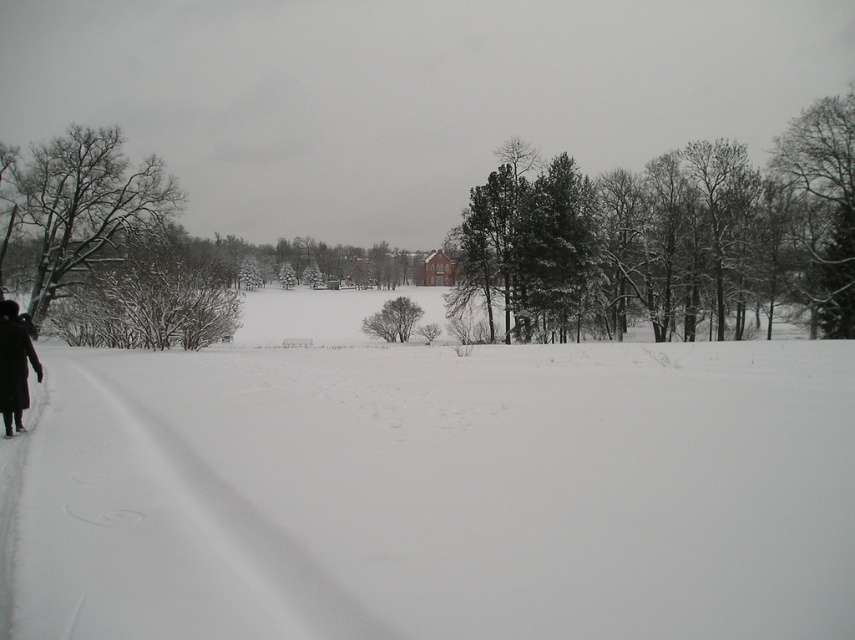
Which is above, black matte coat at left or green matte tree at center?

green matte tree at center is higher up.

The image size is (855, 640). I want to click on black matte coat at left, so click(x=15, y=365).

I want to click on black matte coat at left, so click(x=15, y=365).

In the scene shown: Who is taller, snow-covered evergreen tree at upper right or green matte tree at center?

With more height is snow-covered evergreen tree at upper right.

Between snow-covered evergreen tree at upper right and green matte tree at center, which one has less height?

green matte tree at center is shorter.

Is point (812, 147) closer to viewer compared to point (369, 317)?

Yes, it is in front of point (369, 317).

Find the location of a particular element. The width and height of the screenshot is (855, 640). snow-covered evergreen tree at upper right is located at coordinates (824, 204).

Which is more to the right, snow-covered branches at left or green matte tree at center?

From the viewer's perspective, green matte tree at center appears more on the right side.

Is snow-covered branches at left further to camera compared to green matte tree at center?

That is False.

Is point (62, 288) farther from viewer compared to point (407, 321)?

No, it is in front of (407, 321).

Locate an element on the screen. This screenshot has width=855, height=640. snow-covered branches at left is located at coordinates (83, 205).